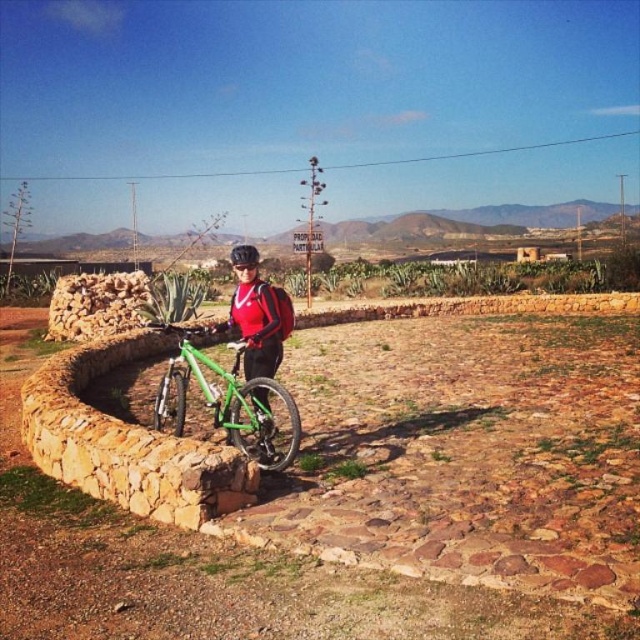
Based on the photo, you are a cyclist preparing to ride your green matte bicycle at center. You notice your black matte bicycle helmet at center is placed on the handlebars. Since the helmet is taller than the bicycle, will it block your view while riding?

The green matte bicycle at center has a lesser height compared to the black matte bicycle helmet at center. Therefore, the black matte bicycle helmet at center placed on the handlebars will block your view while riding because it is taller than the bicycle.

You are a photographer trying to capture the matte red jacket at center and the black matte bicycle helmet at center in a single frame. Since you want both items to be clearly visible, which object should you zoom in on more to ensure the smaller one isn

The matte red jacket at center is smaller than the black matte bicycle helmet at center. To ensure both are clearly visible, you should zoom in more on the matte red jacket at center so its details are not lost in the frame.